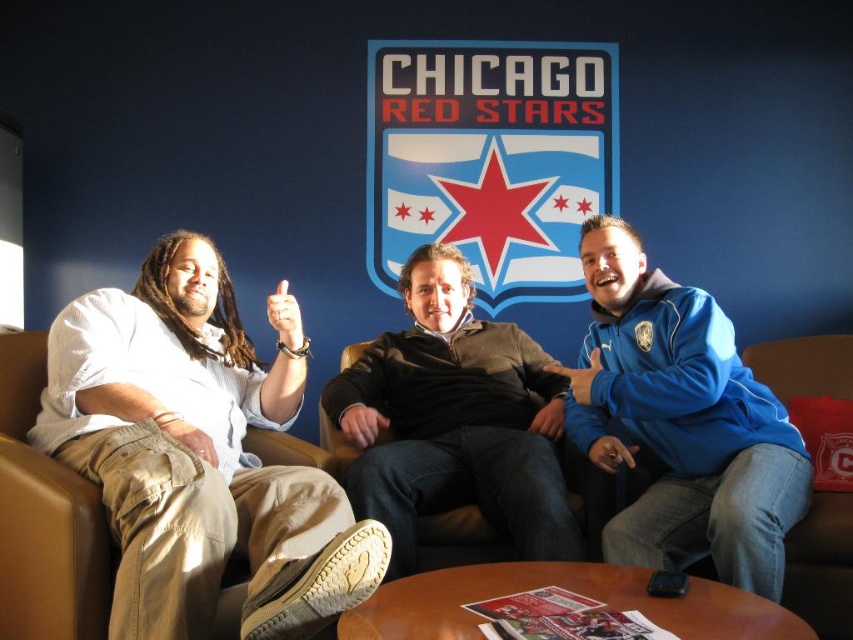
Does blue fleece jacket at right have a larger size compared to brown leather couch at center?

Yes.

Find the location of a particular element. blue fleece jacket at right is located at coordinates (682, 420).

Is khaki cotton pants at left bigger than brown leather couch at center?

Yes.

Who is more distant from viewer, (251, 364) or (13, 529)?

Point (251, 364)

You are a GUI agent. You are given a task and a screenshot of the screen. Output one action in this format:
    pyautogui.click(x=<x>, y=<y>)
    Task: Click on the khaki cotton pants at left
    The image size is (853, 640).
    Given the screenshot: What is the action you would take?
    pyautogui.click(x=199, y=454)

Does khaki cotton pants at left have a greater height compared to dark brown sweater at center?

Correct, khaki cotton pants at left is much taller as dark brown sweater at center.

Can you confirm if khaki cotton pants at left is positioned below dark brown sweater at center?

Yes, khaki cotton pants at left is below dark brown sweater at center.

Describe the element at coordinates (199, 454) in the screenshot. The image size is (853, 640). I see `khaki cotton pants at left` at that location.

The image size is (853, 640). I want to click on khaki cotton pants at left, so click(x=199, y=454).